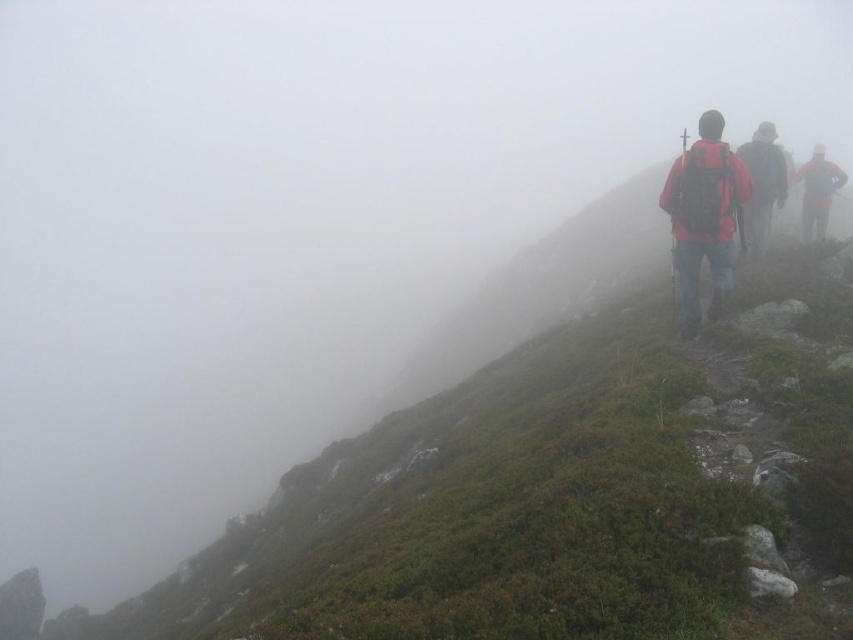
You are a hiker trying to determine the order of the backpacks in the misty mountain trail scene. Which backpack is closer to you, the observer, between the matte pink backpack at right and the red backpack at center?

The matte pink backpack at right is closer to you since it is positioned in front of the red backpack at center.

Looking at this image, you are a hiker planning to place a small emergency beacon on the trail. The beacon must be placed at a specific coordinate point to ensure visibility. Given the scene, can you confirm if the point at coordinate point (704,214) is suitable for placing the beacon, considering the object located there?

The point at coordinate point (704,214) is occupied by a matte pink backpack at right, so placing the beacon there would not be suitable as it is already occupied by the backpack.